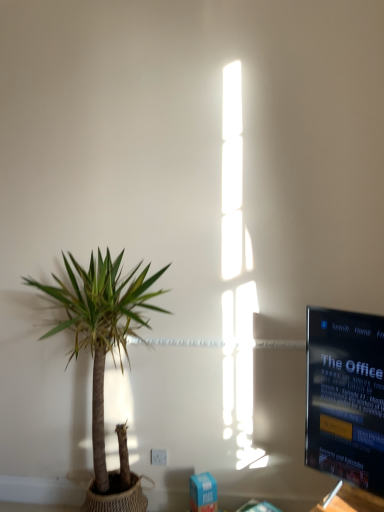
Question: Is green leafy plant at left in front of or behind white plastic electric outlet at lower center in the image?

Choices:
 (A) front
 (B) behind

Answer: (A)

Question: Looking at their shapes, would you say green leafy plant at left is wider or thinner than white plastic electric outlet at lower center?

Choices:
 (A) wide
 (B) thin

Answer: (A)

Question: From the image's perspective, relative to white plastic electric outlet at lower center, is green leafy plant at left above or below?

Choices:
 (A) below
 (B) above

Answer: (B)

Question: Is white plastic electric outlet at lower center to the left or to the right of green leafy plant at left in the image?

Choices:
 (A) right
 (B) left

Answer: (A)

Question: Is point (157, 453) closer or farther from the camera than point (127, 356)?

Choices:
 (A) farther
 (B) closer

Answer: (A)

Question: From the image's perspective, is white plastic electric outlet at lower center located above or below green leafy plant at left?

Choices:
 (A) below
 (B) above

Answer: (A)

Question: From a real-world perspective, relative to green leafy plant at left, is white plastic electric outlet at lower center vertically above or below?

Choices:
 (A) above
 (B) below

Answer: (B)